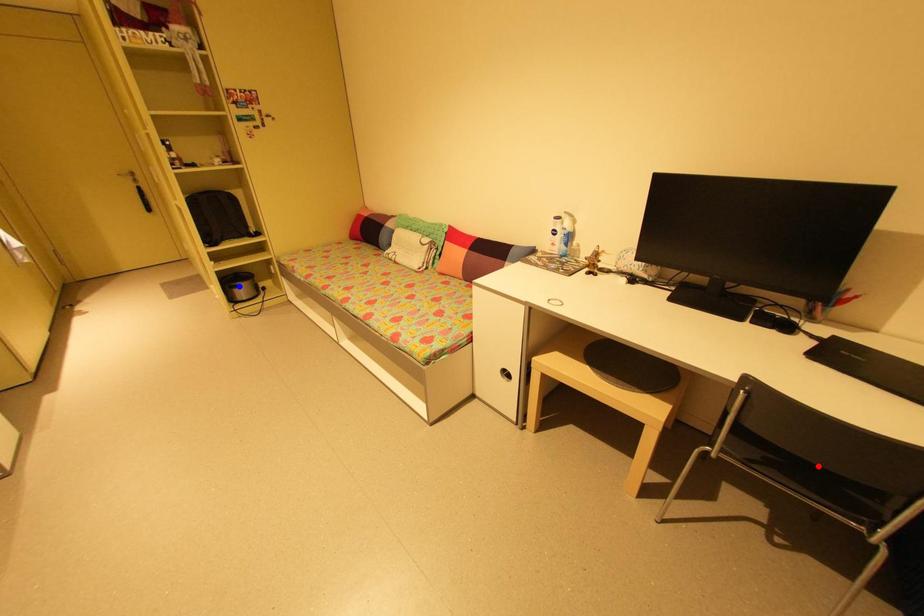
Question: In the image, two points are highlighted. Which point is nearer to the camera? Reply with the corresponding letter.

Choices:
 (A) blue point
 (B) red point

Answer: (B)